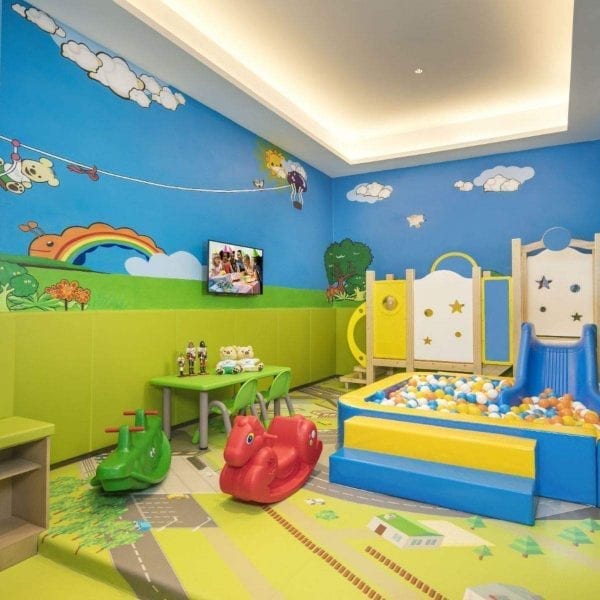
The image size is (600, 600). I want to click on white ceiling, so tap(279, 127).